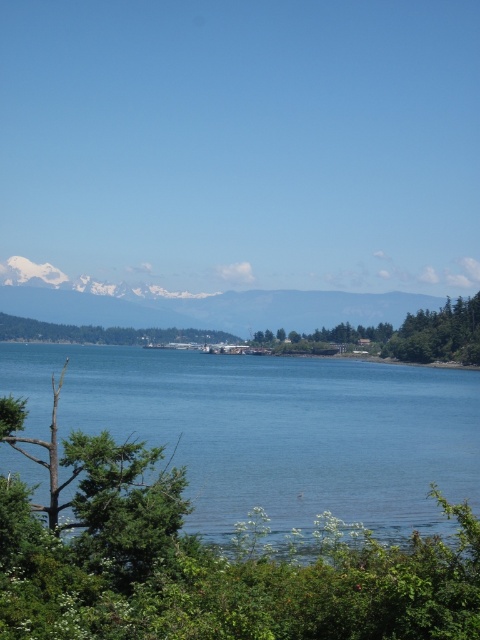
What is the spatial relationship between the green leafy trees at center and the point labeled as point (408,333)?

The point labeled as point (408,333) represents the green leafy trees at center.

You are standing at the edge of the coastal landscape and want to take a photo that includes both the snowy white mountain at upper center and the green leafy tree at center. Which object will appear bigger in the photo?

The snowy white mountain at upper center will appear bigger in the photo because it is larger in size than the green leafy tree at center.

You are an artist planning to paint the coastal landscape. You want to ensure the snowy white mountain at upper center and the green leafy tree at center are proportionally accurate. Which object should you paint wider to maintain the correct proportions?

The snowy white mountain at upper center should be painted wider than the green leafy tree at center because its width surpasses the tree.